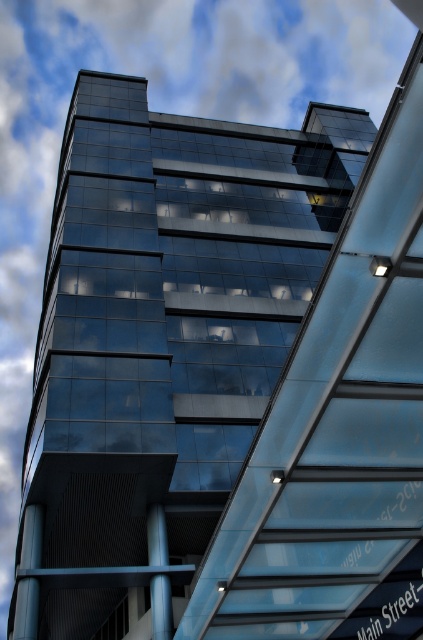
In the scene shown: You are standing in front of the modern glass building and want to take a photo of the entire structure without any obstructions. You notice there is a metallic gray pillar at lower left. Based on its position, would you need to move to the left or right to avoid it in your shot?

The metallic gray pillar at lower left is positioned at point (25, 609), which is very close to the lower right edge of the image. To avoid it in your photo, you should move slightly to the left to ensure the pillar is not in the frame.

You are standing in front of the modern glass building and notice the metallic gray pillar at lower left and the metallic blue pole at center. Which object is positioned higher from the ground?

The metallic gray pillar at lower left is located above the metallic blue pole at center, so it is positioned higher from the ground.

You are standing at the base of the building and want to place a decorative plant between the metallic gray pillar at lower left and the metallic blue pole at center. If the plant requires 5 feet of space, will there be enough room?

The metallic gray pillar at lower left is 10.65 feet away from the metallic blue pole at center, so yes, there is enough space to place the plant requiring 5 feet of space between them.